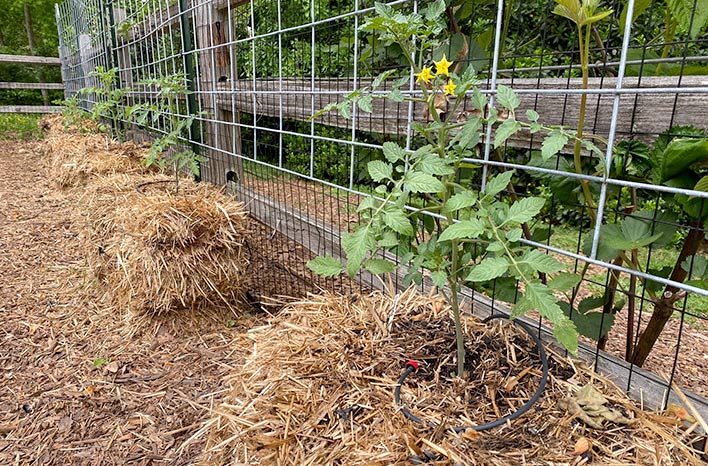
You are a GUI agent. You are given a task and a screenshot of the screen. Output one action in this format:
    pyautogui.click(x=<x>, y=<y>)
    Task: Click on the plant
    
    Given the screenshot: What is the action you would take?
    pyautogui.click(x=539, y=296)